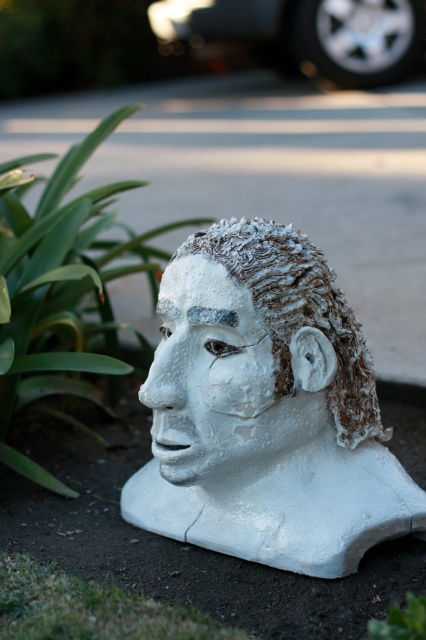
Question: Does green leafy plant at lower left appear under green grass at lower left?

Choices:
 (A) yes
 (B) no

Answer: (B)

Question: Is green leafy plant at lower left below white frosted bust at center?

Choices:
 (A) yes
 (B) no

Answer: (B)

Question: Is white matte bust at center to the left of green grass at lower left from the viewer's perspective?

Choices:
 (A) yes
 (B) no

Answer: (B)

Question: Among these points, which one is nearest to the camera?

Choices:
 (A) (34, 604)
 (B) (408, 616)
 (C) (198, 477)

Answer: (B)

Question: Considering the real-world distances, which object is farthest from the green leafy plant at lower right?

Choices:
 (A) green grass at lower left
 (B) green leafy plant at lower left
 (C) white matte bust at center

Answer: (B)

Question: Among these points, which one is farthest from the camera?

Choices:
 (A) (129, 630)
 (B) (328, 417)
 (C) (371, 624)

Answer: (B)